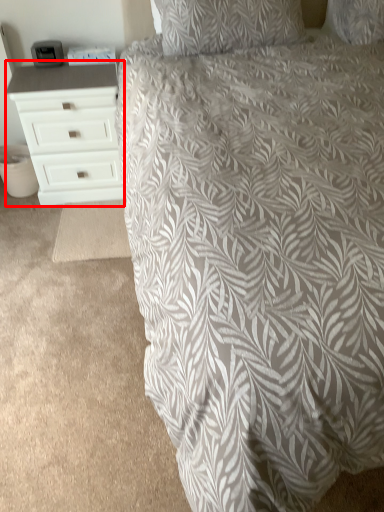
Question: Where is chest of drawers (annotated by the red box) located in relation to bed in the image?

Choices:
 (A) right
 (B) left

Answer: (B)